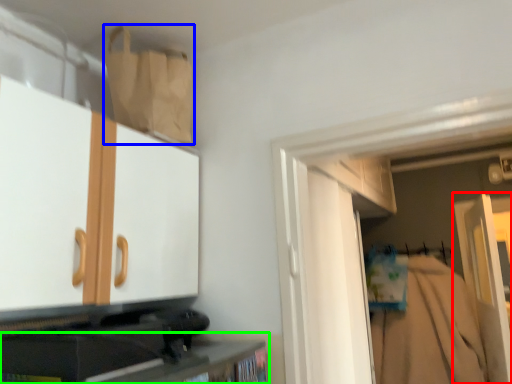
Question: Which object is positioned farthest from door (highlighted by a red box)? Select from paper bag (highlighted by a blue box) and cabinetry (highlighted by a green box).

Choices:
 (A) paper bag
 (B) cabinetry

Answer: (A)